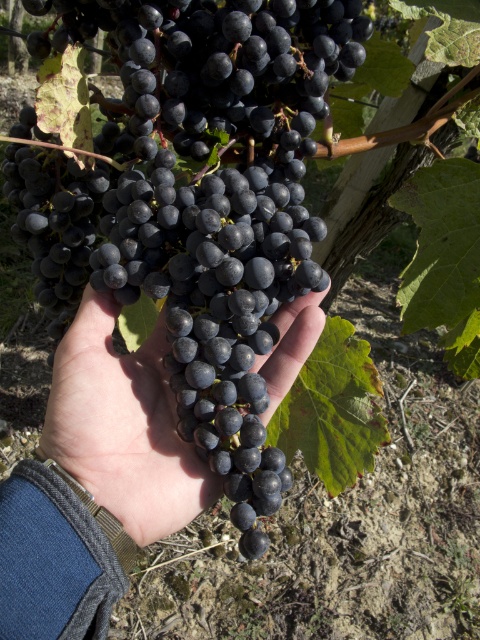
Question: Does shiny dark purple grapes at center appear over matte black grapes at center?

Choices:
 (A) no
 (B) yes

Answer: (B)

Question: Which of the following is the farthest from the observer?

Choices:
 (A) (290, 314)
 (B) (325, 10)

Answer: (A)

Question: Which point appears farthest from the camera in this image?

Choices:
 (A) (93, 134)
 (B) (159, 467)

Answer: (A)

Question: Does shiny dark purple grapes at center appear over matte black grapes at center?

Choices:
 (A) no
 (B) yes

Answer: (B)

Question: Observing the image, what is the correct spatial positioning of shiny dark purple grapes at center in reference to matte black grapes at center?

Choices:
 (A) above
 (B) below

Answer: (A)